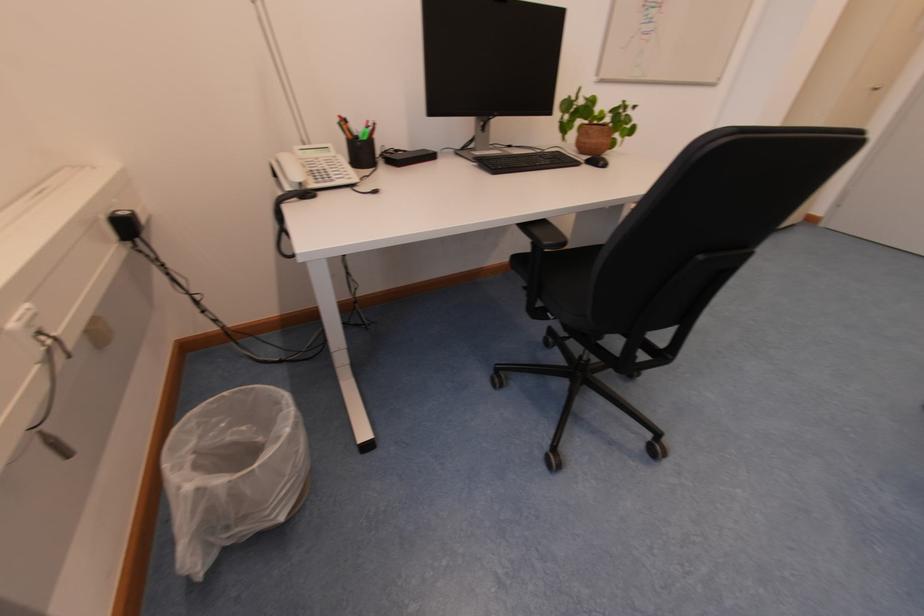
Where would you grasp the chair armrest? Please return your answer as a coordinate pair (x, y).

(545, 232)